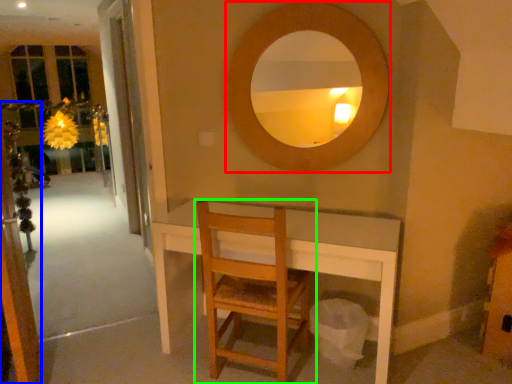
Question: Which is farther away from mirror (highlighted by a red box)? screen door (highlighted by a blue box) or chair (highlighted by a green box)?

Choices:
 (A) screen door
 (B) chair

Answer: (A)